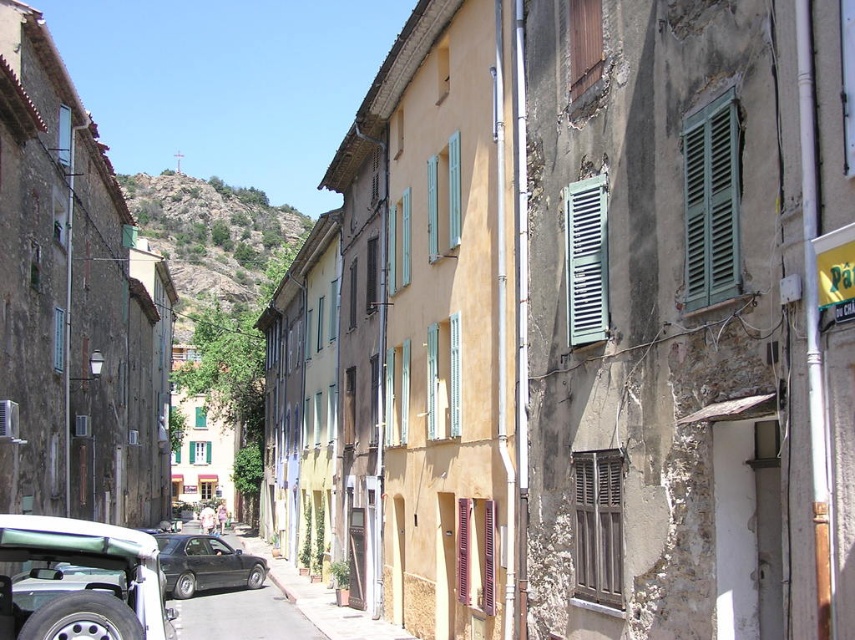
Does silver metallic jeep at lower left have a greater height compared to green painted wood shutter at upper right?

No, silver metallic jeep at lower left is not taller than green painted wood shutter at upper right.

Does point (133, 620) come in front of point (575, 330)?

Yes, point (133, 620) is closer to viewer.

Describe the element at coordinates (84, 580) in the screenshot. The height and width of the screenshot is (640, 855). I see `silver metallic jeep at lower left` at that location.

Locate an element on the screen. silver metallic jeep at lower left is located at coordinates (84, 580).

Who is shorter, wooden shutters at center or brown wooden shutter at upper center?

Standing shorter between the two is brown wooden shutter at upper center.

Which is in front, point (604, 598) or point (570, 8)?

Point (604, 598) is more forward.

Between point (620, 548) and point (581, 19), which one is positioned behind?

Positioned behind is point (581, 19).

The height and width of the screenshot is (640, 855). Find the location of `wooden shutters at center`. wooden shutters at center is located at coordinates (597, 525).

Is green painted wood shutter at upper right thinner than shiny black sedan at center?

Indeed, green painted wood shutter at upper right has a lesser width compared to shiny black sedan at center.

The height and width of the screenshot is (640, 855). Describe the element at coordinates (587, 260) in the screenshot. I see `green painted wood shutter at upper right` at that location.

Describe the element at coordinates (587, 260) in the screenshot. This screenshot has width=855, height=640. I see `green painted wood shutter at upper right` at that location.

In order to click on green painted wood shutter at upper right in this screenshot , I will do `click(587, 260)`.